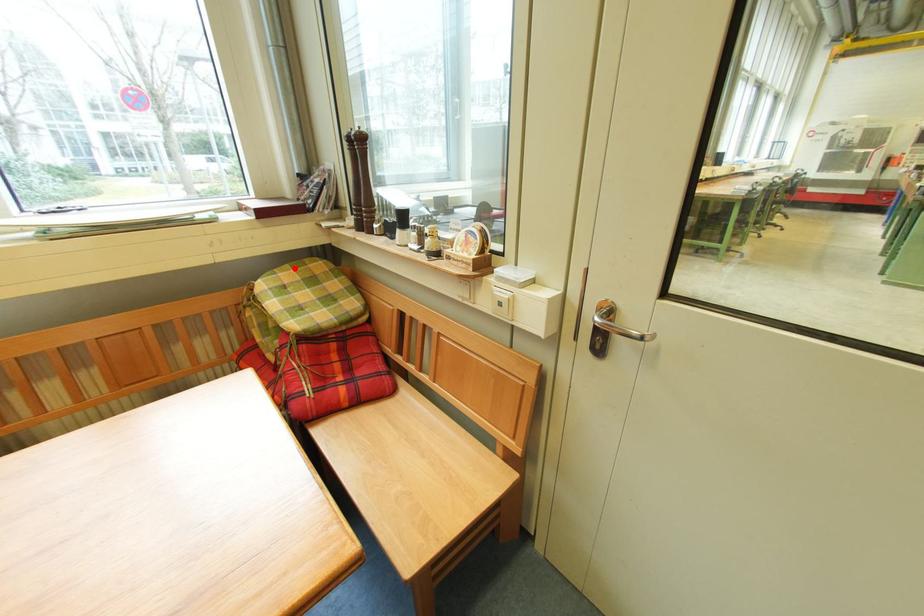
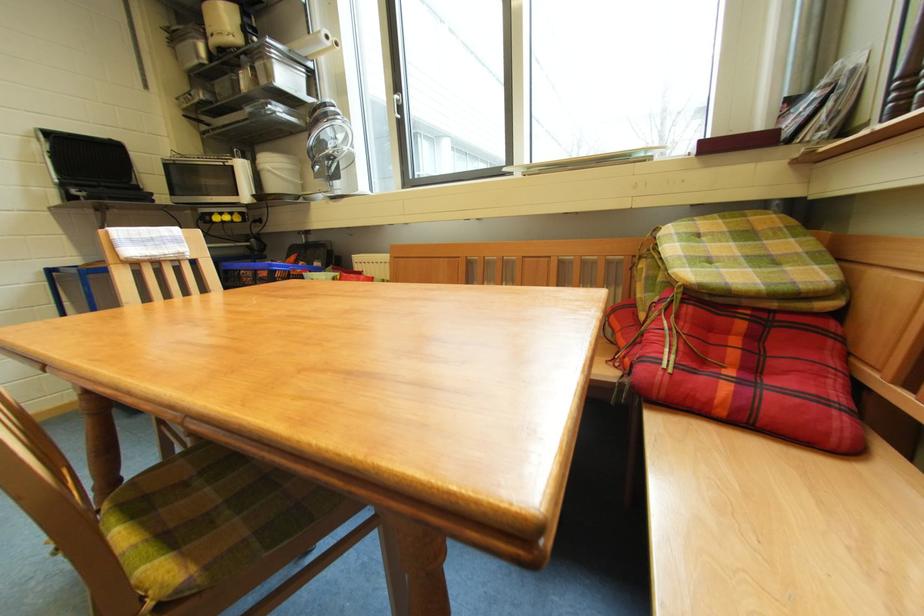
In the second image, find the point that corresponds to the highlighted location in the first image.

(723, 219)